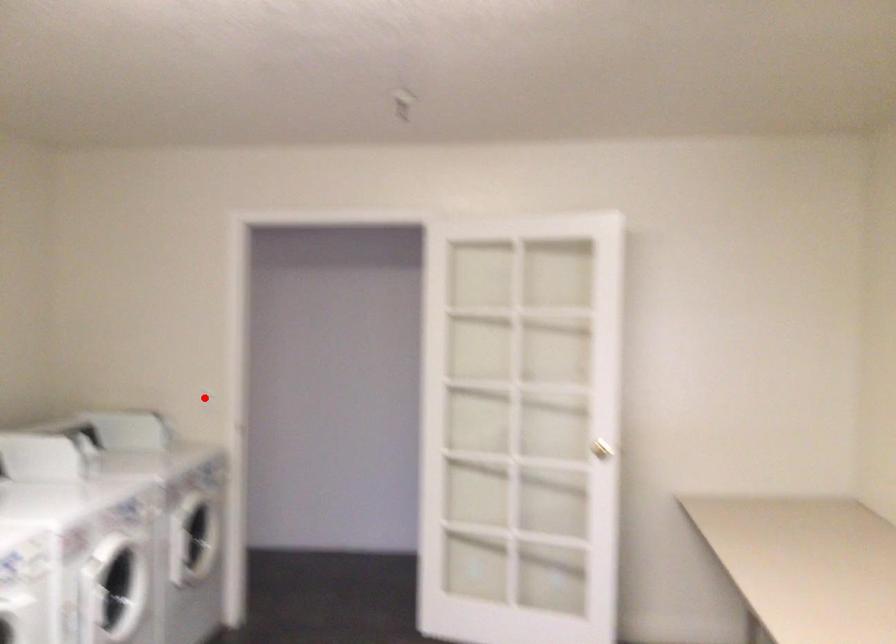
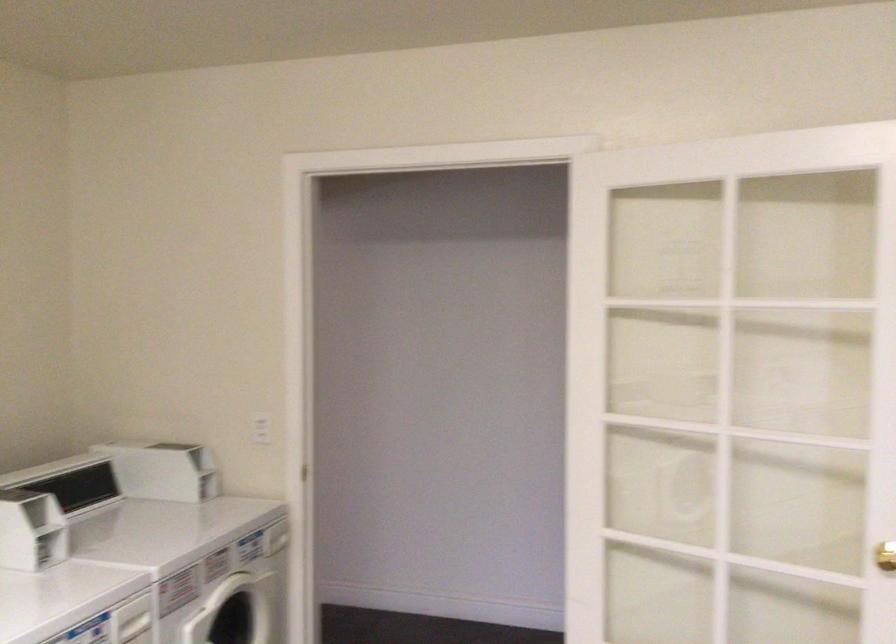
Question: I am providing you with two images of the same scene from different viewpoints. Given a red point in image1, look at the same physical point in image2. Is it:

Choices:
 (A) Closer to the viewpoint
 (B) Farther from the viewpoint

Answer: (A)